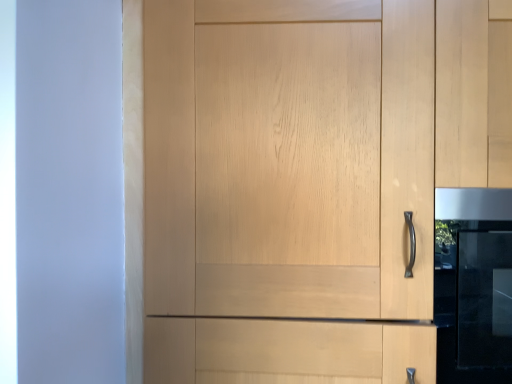
Question: Is light wood cupboard at center at the right side of satin black oven at right?

Choices:
 (A) no
 (B) yes

Answer: (A)

Question: Is light wood cupboard at center wider than satin black oven at right?

Choices:
 (A) yes
 (B) no

Answer: (A)

Question: Does light wood cupboard at center have a lesser width compared to satin black oven at right?

Choices:
 (A) yes
 (B) no

Answer: (B)

Question: Is light wood cupboard at center taller than satin black oven at right?

Choices:
 (A) yes
 (B) no

Answer: (A)

Question: From the image's perspective, is light wood cupboard at center under satin black oven at right?

Choices:
 (A) yes
 (B) no

Answer: (B)

Question: Is light wood cupboard at center smaller than satin black oven at right?

Choices:
 (A) no
 (B) yes

Answer: (A)

Question: Is satin black oven at right smaller than light wood cupboard at center?

Choices:
 (A) no
 (B) yes

Answer: (B)

Question: Is satin black oven at right shorter than light wood cupboard at center?

Choices:
 (A) yes
 (B) no

Answer: (A)

Question: Is satin black oven at right aimed at light wood cupboard at center?

Choices:
 (A) yes
 (B) no

Answer: (A)

Question: From the image's perspective, would you say satin black oven at right is positioned over light wood cupboard at center?

Choices:
 (A) yes
 (B) no

Answer: (B)

Question: Is satin black oven at right wider than light wood cupboard at center?

Choices:
 (A) yes
 (B) no

Answer: (B)

Question: Is light wood cupboard at center at the back of satin black oven at right?

Choices:
 (A) no
 (B) yes

Answer: (B)

Question: Is light wood cupboard at center to the left or to the right of satin black oven at right in the image?

Choices:
 (A) left
 (B) right

Answer: (A)